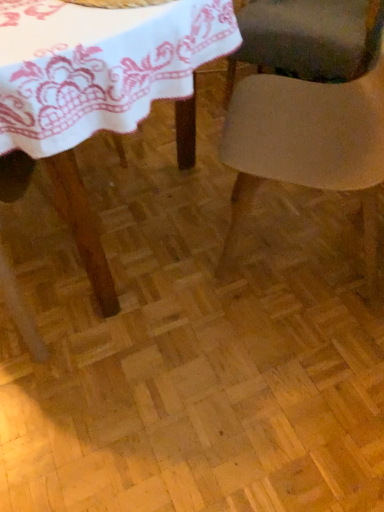
Question: Does smooth beige chair at center, which appears as the second chair when viewed from the back, turn towards matte gray chair at center, the second chair from the front?

Choices:
 (A) no
 (B) yes

Answer: (A)

Question: From the image's perspective, is smooth beige chair at center, the first chair from the front, above matte gray chair at center, the second chair from the front?

Choices:
 (A) no
 (B) yes

Answer: (A)

Question: Can you confirm if smooth beige chair at center, the first chair from the front, is shorter than matte gray chair at center, which is the second chair from bottom to top?

Choices:
 (A) yes
 (B) no

Answer: (B)

Question: From a real-world perspective, is smooth beige chair at center, which appears as the second chair when viewed from the back, below matte gray chair at center, which is counted as the first chair, starting from the back?

Choices:
 (A) no
 (B) yes

Answer: (A)

Question: Considering the relative sizes of smooth beige chair at center, which appears as the second chair when viewed from the back, and matte gray chair at center, which is counted as the first chair, starting from the back, in the image provided, is smooth beige chair at center, which appears as the second chair when viewed from the back, wider than matte gray chair at center, which is counted as the first chair, starting from the back,?

Choices:
 (A) no
 (B) yes

Answer: (A)

Question: Is matte gray chair at center, which is counted as the first chair, starting from the back, spatially inside smooth beige chair at center, placed as the second chair when sorted from top to bottom, or outside of it?

Choices:
 (A) inside
 (B) outside

Answer: (B)

Question: Would you say matte gray chair at center, which is counted as the first chair, starting from the back, is to the left or to the right of smooth beige chair at center, which appears as the second chair when viewed from the back, in the picture?

Choices:
 (A) right
 (B) left

Answer: (A)

Question: Based on their sizes in the image, would you say matte gray chair at center, the 1th chair positioned from the top, is bigger or smaller than smooth beige chair at center, which appears as the second chair when viewed from the back?

Choices:
 (A) small
 (B) big

Answer: (B)

Question: From the image's perspective, is matte gray chair at center, which is counted as the first chair, starting from the back, above or below smooth beige chair at center, placed as the second chair when sorted from top to bottom?

Choices:
 (A) below
 (B) above

Answer: (B)

Question: From a real-world perspective, is smooth beige chair at center, which appears as the second chair when viewed from the back, physically located above or below matte gray chair at center, the second chair from the front?

Choices:
 (A) below
 (B) above

Answer: (B)

Question: From the image's perspective, is smooth beige chair at center, which appears as the 1th chair when ordered from the bottom, positioned above or below matte gray chair at center, which is counted as the first chair, starting from the back?

Choices:
 (A) above
 (B) below

Answer: (B)

Question: Is point (246, 170) closer or farther from the camera than point (284, 54)?

Choices:
 (A) closer
 (B) farther

Answer: (A)

Question: Considering the positions of smooth beige chair at center, the first chair from the front, and matte gray chair at center, the 1th chair positioned from the top, in the image, is smooth beige chair at center, the first chair from the front, wider or thinner than matte gray chair at center, the 1th chair positioned from the top,?

Choices:
 (A) wide
 (B) thin

Answer: (B)

Question: Choose the correct answer: Is smooth beige chair at center, which appears as the 1th chair when ordered from the bottom, inside white lace tablecloth at upper left or outside it?

Choices:
 (A) inside
 (B) outside

Answer: (B)

Question: In terms of size, does smooth beige chair at center, placed as the second chair when sorted from top to bottom, appear bigger or smaller than white lace tablecloth at upper left?

Choices:
 (A) small
 (B) big

Answer: (B)